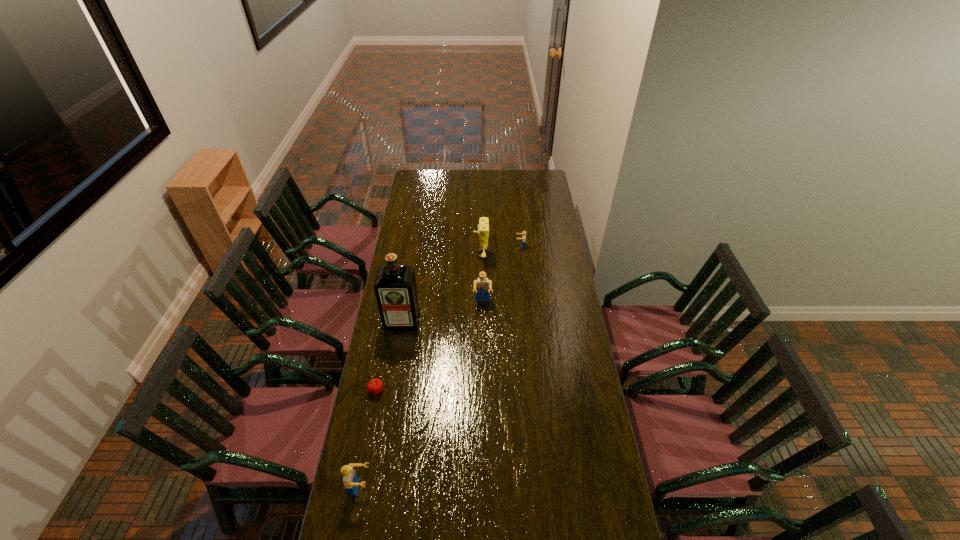
Where is `Lego at the left edge`? Lego at the left edge is located at coordinates (351, 481).

Image resolution: width=960 pixels, height=540 pixels. I want to click on liquor located at the left edge, so click(395, 287).

Image resolution: width=960 pixels, height=540 pixels. Identify the location of cherry located in the left edge section of the desktop. (375, 386).

Identify the location of free region at the far edge of the desktop. (519, 187).

The image size is (960, 540). Find the location of `vacant space at the near edge`. vacant space at the near edge is located at coordinates (497, 519).

In the image, there is a desktop. Identify the location of free space at the left edge. Image resolution: width=960 pixels, height=540 pixels. (408, 347).

Image resolution: width=960 pixels, height=540 pixels. I want to click on vacant point at the right edge, so click(540, 257).

Image resolution: width=960 pixels, height=540 pixels. In order to click on vacant region at the far right corner of the desktop in this screenshot , I will do `click(526, 180)`.

At what (x,y) coordinates should I click in order to perform the action: click on free space between the tallest object and the sponge. Please return your answer as a coordinate pair (x, y). Looking at the image, I should click on (442, 288).

Where is `free space that is in between the fourth farthest object and the second Lego from right to left`? The height and width of the screenshot is (540, 960). free space that is in between the fourth farthest object and the second Lego from right to left is located at coordinates (443, 312).